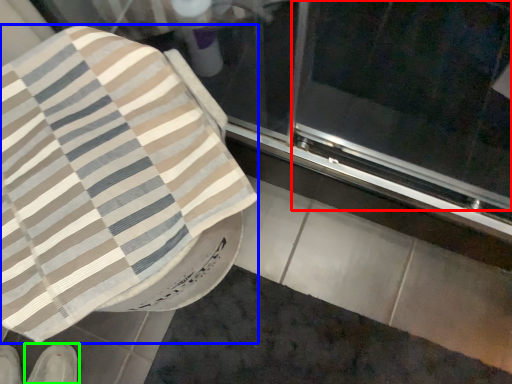
Question: Estimate the real-world distances between objects in this image. Which object is farther from screen door (highlighted by a red box), blanket (highlighted by a blue box) or footwear (highlighted by a green box)?

Choices:
 (A) blanket
 (B) footwear

Answer: (B)